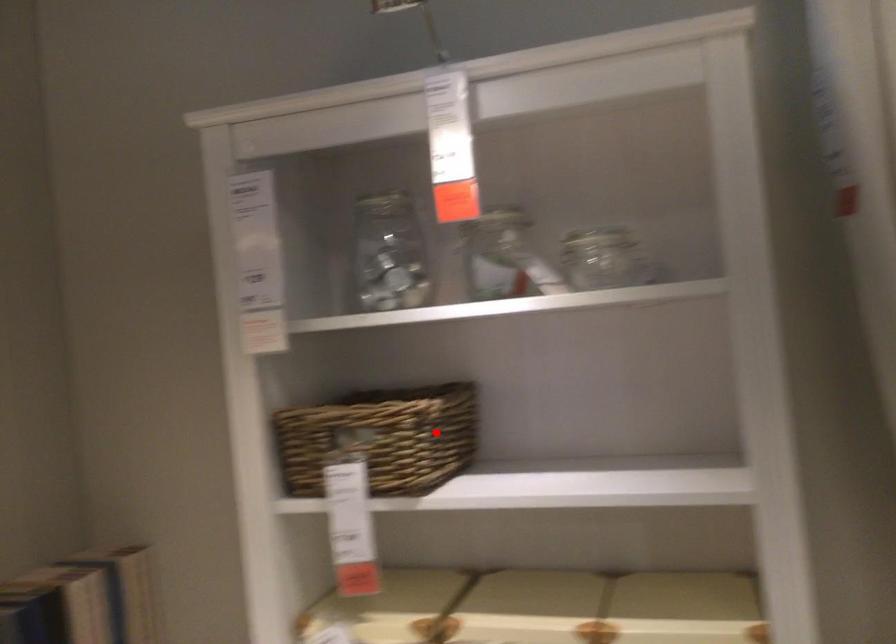
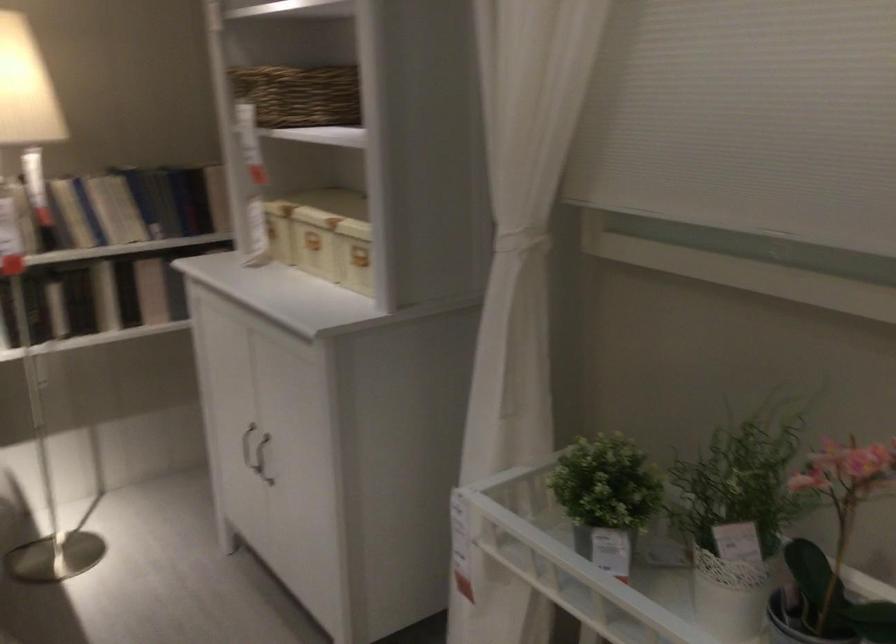
The point at the highlighted location is marked in the first image. Where is the corresponding point in the second image?

(298, 93)